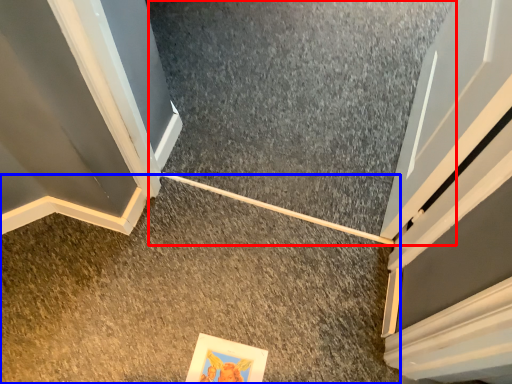
Question: Which point is further to the camera, concrete (highlighted by a red box) or concrete (highlighted by a blue box)?

Choices:
 (A) concrete
 (B) concrete

Answer: (A)